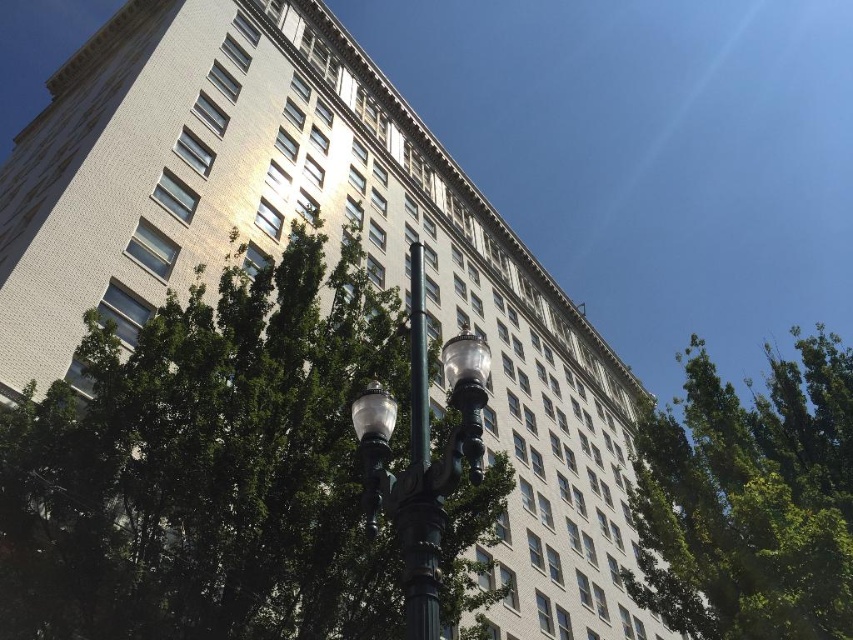
Where is `green leafy tree at center`? This screenshot has width=853, height=640. green leafy tree at center is located at coordinates (210, 468).

Which is above, green leafy tree at center or green polished metal street light at center?

green polished metal street light at center

Is point (436, 451) farther from camera compared to point (387, 483)?

Yes, point (436, 451) is behind point (387, 483).

The image size is (853, 640). Identify the location of green leafy tree at center. (210, 468).

Is green leafy tree at upper right bigger than black metal pole at center?

Yes, green leafy tree at upper right is bigger than black metal pole at center.

Looking at this image, between green leafy tree at upper right and black metal pole at center, which one has less height?

With less height is black metal pole at center.

Where is `green leafy tree at upper right`? The image size is (853, 640). green leafy tree at upper right is located at coordinates (750, 499).

Looking at this image, does green polished metal street light at center have a greater width compared to black metal pole at center?

Correct, the width of green polished metal street light at center exceeds that of black metal pole at center.

Does green polished metal street light at center appear on the right side of black metal pole at center?

Yes, green polished metal street light at center is to the right of black metal pole at center.

Is point (370, 392) closer to camera compared to point (425, 369)?

No, (370, 392) is further to viewer.

Find the location of a particular element. The height and width of the screenshot is (640, 853). green polished metal street light at center is located at coordinates (422, 461).